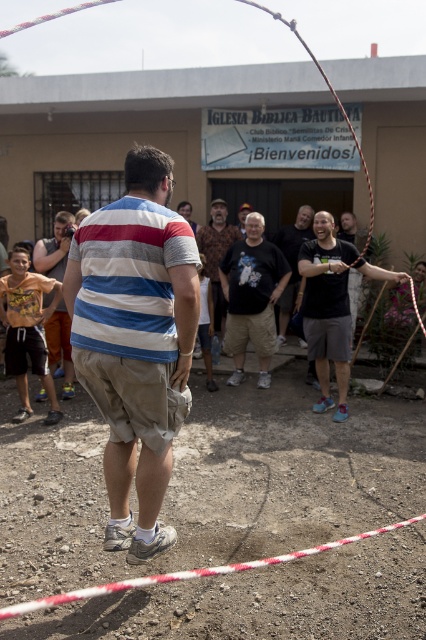
Question: Which of the following is the closest to the observer?

Choices:
 (A) matte black shirt at center
 (B) black t-shirt at center
 (C) rope at center
 (D) black cotton t-shirt at center

Answer: (C)

Question: Which point is farther to the camera?

Choices:
 (A) yellow t-shirt at center
 (B) black cotton t-shirt at center
 (C) matte black shirt at center

Answer: (C)

Question: Estimate the real-world distances between objects in this image. Which object is closer to the matte striped shirt at center?

Choices:
 (A) yellow t-shirt at center
 (B) matte black shirt at center

Answer: (B)

Question: Is striped cotton shirt at center thinner than black cotton t-shirt at center?

Choices:
 (A) yes
 (B) no

Answer: (A)

Question: Does striped cotton shirt at center appear under black t-shirt at center?

Choices:
 (A) no
 (B) yes

Answer: (B)

Question: Does striped cotton shirt at center come in front of black cotton t-shirt at center?

Choices:
 (A) yes
 (B) no

Answer: (A)